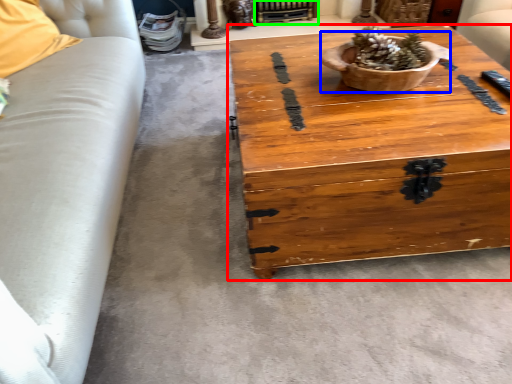
Question: Which object is the closest to the coffee table (highlighted by a red box)? Choose among these: flowerpot (highlighted by a blue box) or fireplace (highlighted by a green box).

Choices:
 (A) flowerpot
 (B) fireplace

Answer: (A)